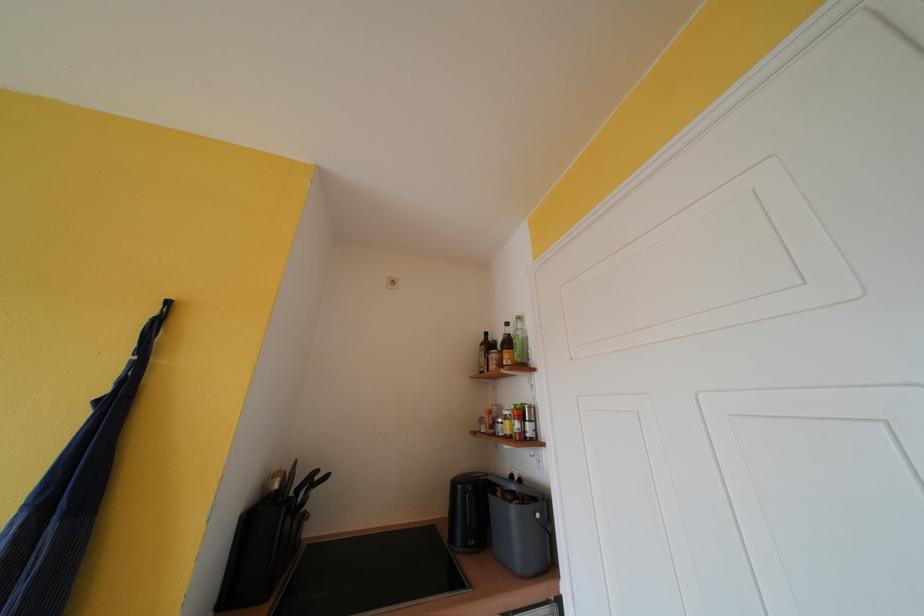
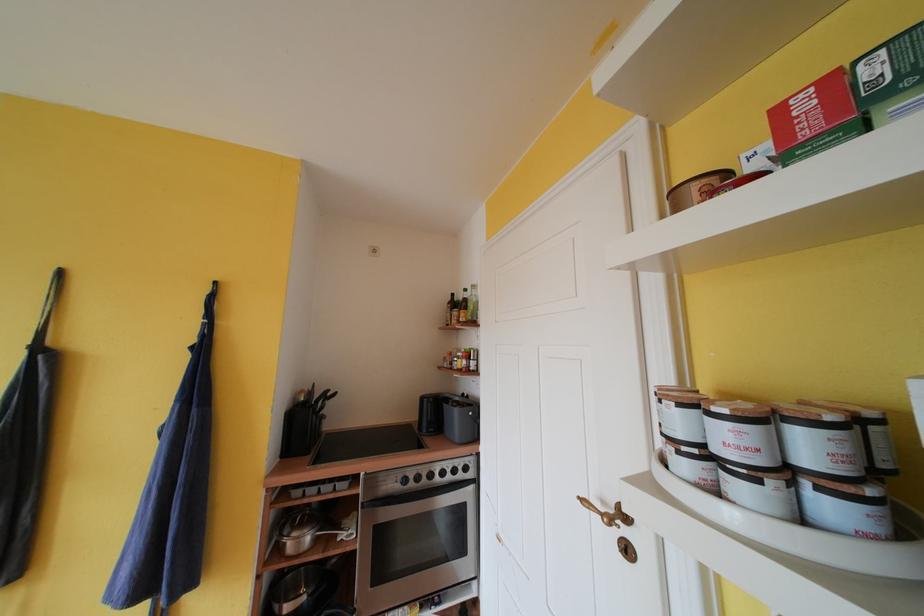
Where in the second image is the point corresponding to (271,490) from the first image?

(301, 402)